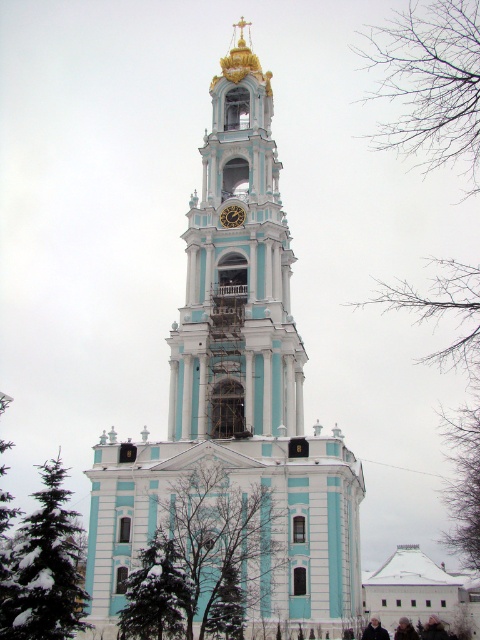
Question: Where is bare branches at lower right located in relation to green needle-like tree at lower left in the image?

Choices:
 (A) above
 (B) below

Answer: (A)

Question: Which object is closer to the camera taking this photo?

Choices:
 (A) gold metallic clock at center
 (B) teal glossy tower at center
 (C) light blue stone bell tower at center

Answer: (B)

Question: Which point is farther to the camera?

Choices:
 (A) (245, 396)
 (B) (37, 522)

Answer: (A)

Question: Does teal glossy tower at center come in front of green leafy tree at lower left?

Choices:
 (A) no
 (B) yes

Answer: (A)

Question: Is bare branches at lower right to the left of green needle-like tree at lower left from the viewer's perspective?

Choices:
 (A) yes
 (B) no

Answer: (B)

Question: Which of the following is the closest to the observer?

Choices:
 (A) (41, 512)
 (B) (294, 515)
 (C) (452, 156)
 (D) (145, 566)

Answer: (D)